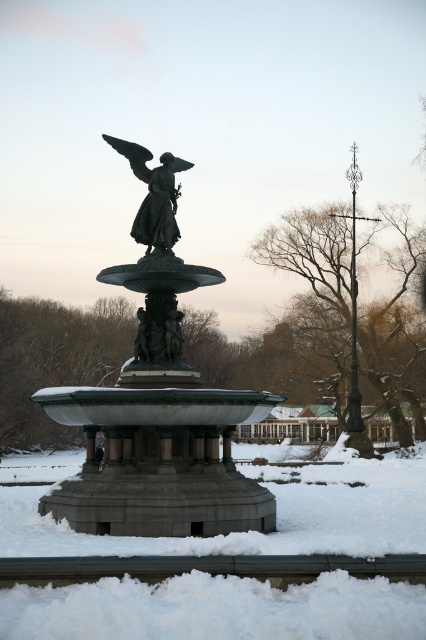
Question: Which point is closer to the camera taking this photo?

Choices:
 (A) (160, 172)
 (B) (126, 376)

Answer: (B)

Question: Is white fluffy snow at center bigger than polished bronze angel at center?

Choices:
 (A) no
 (B) yes

Answer: (B)

Question: Can you confirm if white fluffy snow at center is positioned above bronze statue at center?

Choices:
 (A) yes
 (B) no

Answer: (B)

Question: Among these objects, which one is farthest from the camera?

Choices:
 (A) white fluffy snow at center
 (B) polished bronze angel at center
 (C) bronze statue at center

Answer: (B)

Question: Is white fluffy snow at center further to camera compared to bronze statue at center?

Choices:
 (A) yes
 (B) no

Answer: (B)

Question: Which point is closer to the camera taking this photo?

Choices:
 (A) (362, 550)
 (B) (121, 502)
 (C) (150, 176)

Answer: (A)